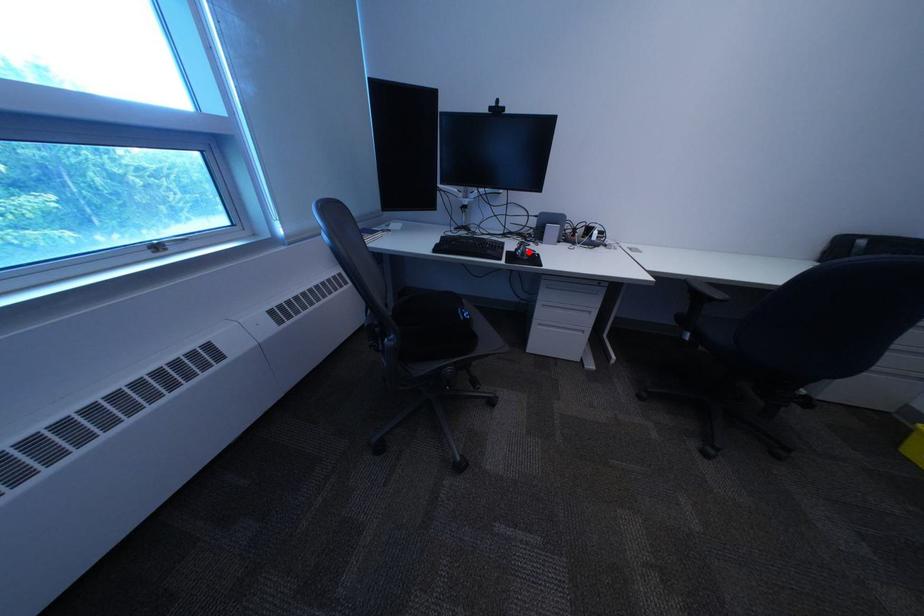
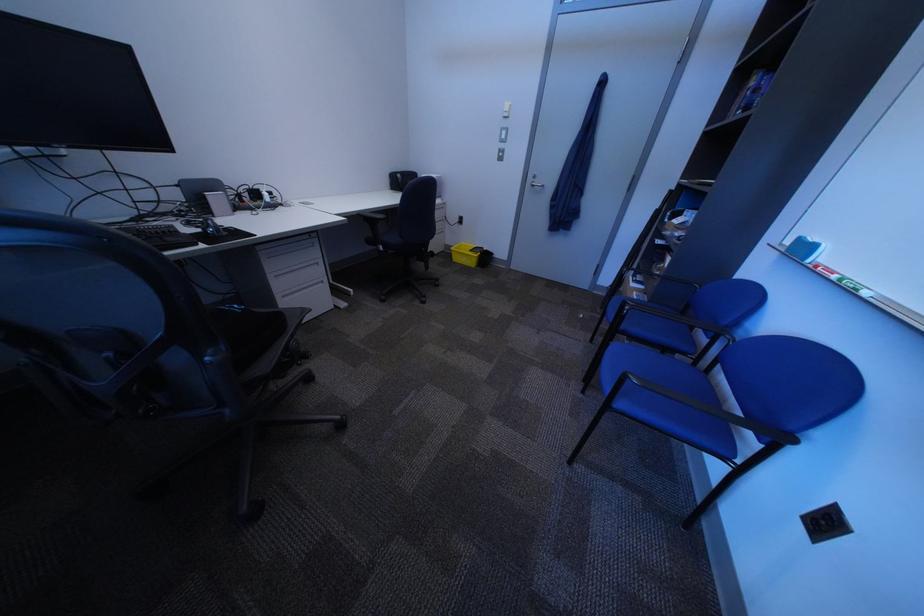
Question: I am providing you with two images of the same scene from different viewpoints. A red point is shown in image1. For the corresponding object point in image2, is it positioned nearer or farther from the camera?

Choices:
 (A) Nearer
 (B) Farther

Answer: (B)